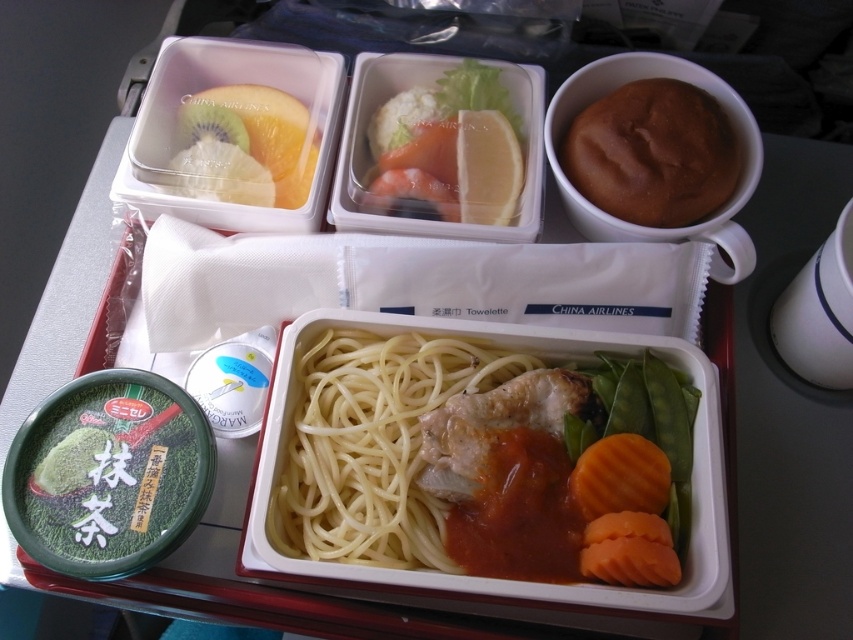
What is located at the coordinates point (373, 444) on the tray?

The yellow matte noodles at center are located at point (373, 444) on the tray.

You are a passenger on China Airlines and want to reach for the fruit in the top left corner of the tray. There are two points on the tray marked as point 1 at coordinates (527, 356) and point 2 at coordinates (607, 189). Which point is closer to you when you are looking at the tray?

Point (527, 356) is closer to you because it is further to the camera than point (607, 189).

You are a flight attendant checking the height of the items on the tray to ensure they fit in the overhead compartment. The height limit is 10 cm. You see the yellow matte noodles at center and the brown matte bread roll at upper right. Which item exceeds the height limit?

The yellow matte noodles at center is much taller than the brown matte bread roll at upper right. If the height limit is 10 cm, the yellow matte noodles at center likely exceeds it while the bread roll does not.